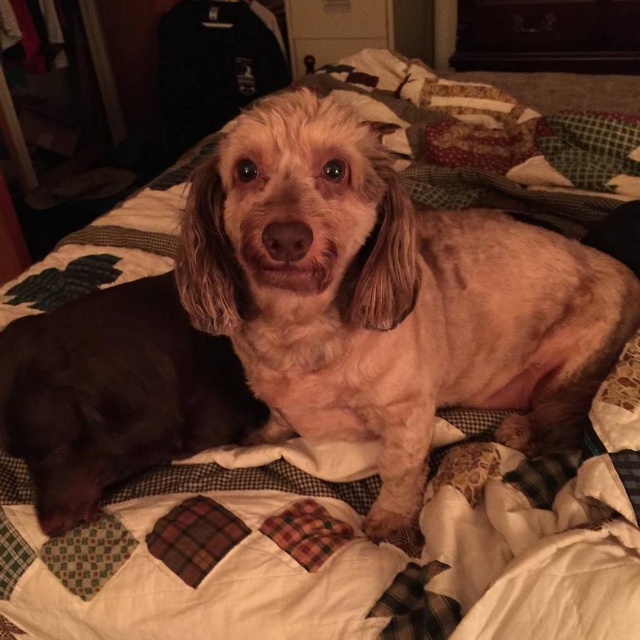
Does point (193, 310) lie in front of point (192, 364)?

Yes, point (193, 310) is closer to viewer.

Which is more to the right, fuzzy brown dog at center or brown fur dog at center?

fuzzy brown dog at center is more to the right.

Measure the distance between point (435,410) and camera.

A distance of 37.64 inches exists between point (435,410) and camera.

This screenshot has width=640, height=640. In order to click on fuzzy brown dog at center in this screenshot , I will do `click(387, 298)`.